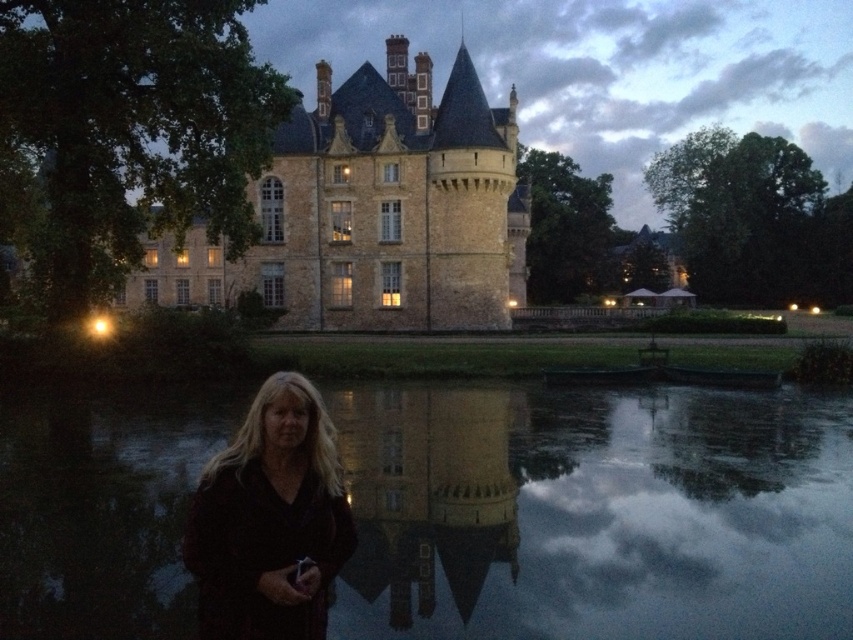
From the picture: Between smooth reflective water at center and dark brown fabric at lower center, which one is positioned higher?

Positioned higher is dark brown fabric at lower center.

Measure the distance between smooth reflective water at center and camera.

smooth reflective water at center is 215.57 feet from camera.

You are a GUI agent. You are given a task and a screenshot of the screen. Output one action in this format:
    pyautogui.click(x=<x>, y=<y>)
    Task: Click on the smooth reflective water at center
    This screenshot has width=853, height=640.
    Given the screenshot: What is the action you would take?
    pyautogui.click(x=595, y=513)